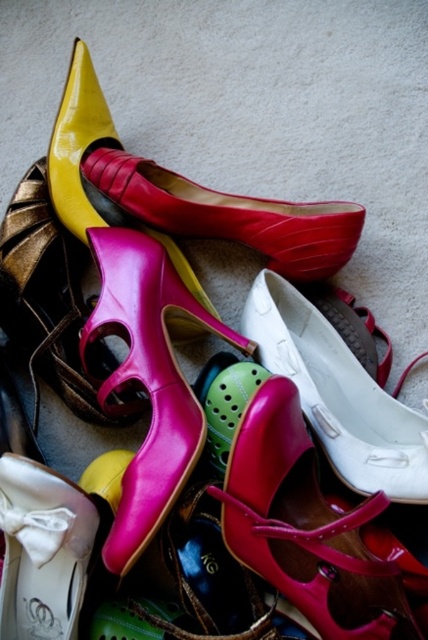
You are organizing a shoe display and need to place a new pair of shoes between the shiny pink sandal at center and the white satin shoe at lower left. Based on their current positions, where should you place the new pair to ensure it is between them?

The shiny pink sandal at center is to the right of the white satin shoe at lower left, so you should place the new pair of shoes to the right of the white satin shoe at lower left but to the left of the shiny pink sandal at center to ensure it is between them.